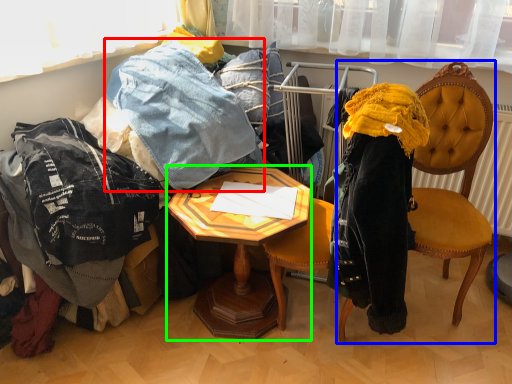
Question: Which object is the closest to the trousers (highlighted by a red box)? Choose among these: chair (highlighted by a blue box) or desk (highlighted by a green box).

Choices:
 (A) chair
 (B) desk

Answer: (B)